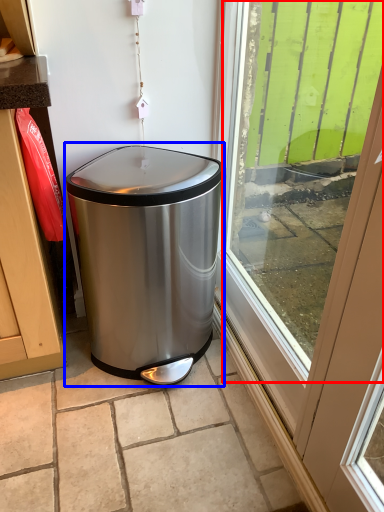
Question: Which of the following is the farthest to the observer, window screen (highlighted by a red box) or waste container (highlighted by a blue box)?

Choices:
 (A) window screen
 (B) waste container

Answer: (B)